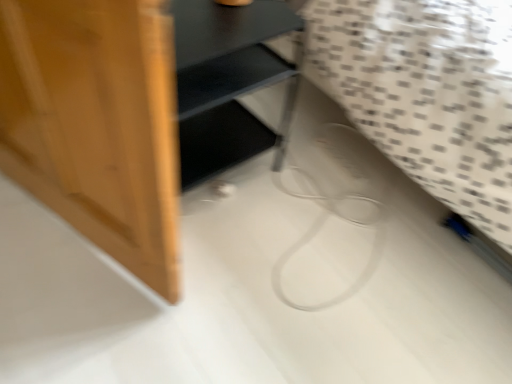
At what (x,y) coordinates should I click in order to perform the action: click on vacant area that is in front of matte black shelf at center. Please return your answer as a coordinate pair (x, y). This screenshot has width=512, height=384. Looking at the image, I should click on (193, 264).